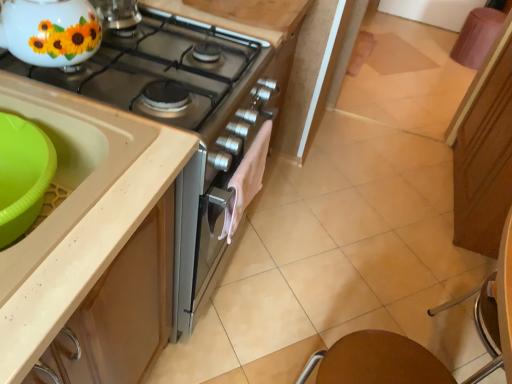
Question: Is green plastic sink at lower left, positioned as the 1th sink in back-to-front order, taller or shorter than brown matte table at lower right?

Choices:
 (A) short
 (B) tall

Answer: (A)

Question: In the image, is green plastic sink at lower left, the 2th sink viewed from the front, positioned in front of or behind brown matte table at lower right?

Choices:
 (A) behind
 (B) front

Answer: (B)

Question: Which of these objects is positioned farthest from the metallic silver gas stove at upper left?

Choices:
 (A) green plastic sink at lower left, positioned as the 1th sink in back-to-front order
 (B) brown matte table at lower right
 (C) beige plastic sink at left, the first sink positioned from the front
 (D) white glossy teapot at upper left
 (E) metallic silver chair at lower right

Answer: (E)

Question: Considering the real-world distances, which object is farthest from the brown matte table at lower right?

Choices:
 (A) green plastic sink at lower left, positioned as the 1th sink in back-to-front order
 (B) beige plastic sink at left, which is the 2th sink from back to front
 (C) metallic silver gas stove at upper left
 (D) white glossy teapot at upper left
 (E) metallic silver chair at lower right

Answer: (D)